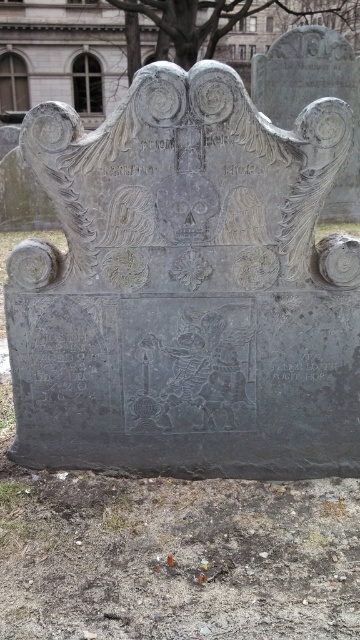
Question: Does gray stone gravestone at center appear over black stone inscription at center?

Choices:
 (A) no
 (B) yes

Answer: (B)

Question: Can you confirm if gray stone gravestone at center is positioned below black stone inscription at center?

Choices:
 (A) no
 (B) yes

Answer: (A)

Question: Is gray stone gravestone at center positioned before black stone inscription at center?

Choices:
 (A) yes
 (B) no

Answer: (A)